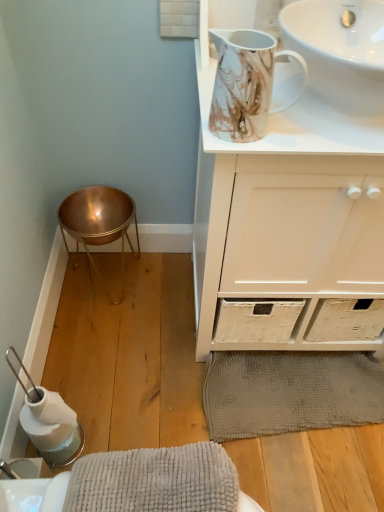
Question: Does white glossy sink at upper right, placed as the second sink when sorted from top to bottom, appear on the left side of copper/metallic bar stool at lower left?

Choices:
 (A) no
 (B) yes

Answer: (A)

Question: Is white glossy sink at upper right, placed as the 1th sink when sorted from bottom to top, positioned behind copper/metallic bar stool at lower left?

Choices:
 (A) yes
 (B) no

Answer: (B)

Question: Is the position of white glossy sink at upper right, placed as the second sink when sorted from top to bottom, less distant than that of copper/metallic bar stool at lower left?

Choices:
 (A) yes
 (B) no

Answer: (A)

Question: Can we say white glossy sink at upper right, placed as the second sink when sorted from top to bottom, lies outside copper/metallic bar stool at lower left?

Choices:
 (A) no
 (B) yes

Answer: (B)

Question: From a real-world perspective, is white glossy sink at upper right, placed as the 1th sink when sorted from bottom to top, located higher than copper/metallic bar stool at lower left?

Choices:
 (A) yes
 (B) no

Answer: (A)

Question: Based on their positions, is copper/metallic bar stool at lower left located to the left or right of white matte cabinet at upper center?

Choices:
 (A) left
 (B) right

Answer: (A)

Question: Considering their positions, is copper/metallic bar stool at lower left located in front of or behind white matte cabinet at upper center?

Choices:
 (A) front
 (B) behind

Answer: (B)

Question: Is point (119, 236) positioned closer to the camera than point (215, 64)?

Choices:
 (A) farther
 (B) closer

Answer: (A)

Question: In terms of size, does copper/metallic bar stool at lower left appear bigger or smaller than white matte cabinet at upper center?

Choices:
 (A) small
 (B) big

Answer: (A)

Question: From a real-world perspective, is white glossy sink at upper right, placed as the 1th sink when sorted from bottom to top, above or below gray textured bath mat at lower center?

Choices:
 (A) above
 (B) below

Answer: (A)

Question: Considering the positions of point (332, 108) and point (258, 403), is point (332, 108) closer or farther from the camera than point (258, 403)?

Choices:
 (A) closer
 (B) farther

Answer: (A)

Question: Based on their positions, is white glossy sink at upper right, placed as the second sink when sorted from top to bottom, located to the left or right of gray textured bath mat at lower center?

Choices:
 (A) right
 (B) left

Answer: (B)

Question: In the image, is white glossy sink at upper right, placed as the second sink when sorted from top to bottom, positioned in front of or behind gray textured bath mat at lower center?

Choices:
 (A) behind
 (B) front

Answer: (B)

Question: Looking at the image, does white glossy sink at upper right, the first sink positioned from the top, seem bigger or smaller compared to white matte cabinet at upper center?

Choices:
 (A) big
 (B) small

Answer: (B)

Question: In terms of width, does white glossy sink at upper right, the first sink positioned from the top, look wider or thinner when compared to white matte cabinet at upper center?

Choices:
 (A) thin
 (B) wide

Answer: (A)